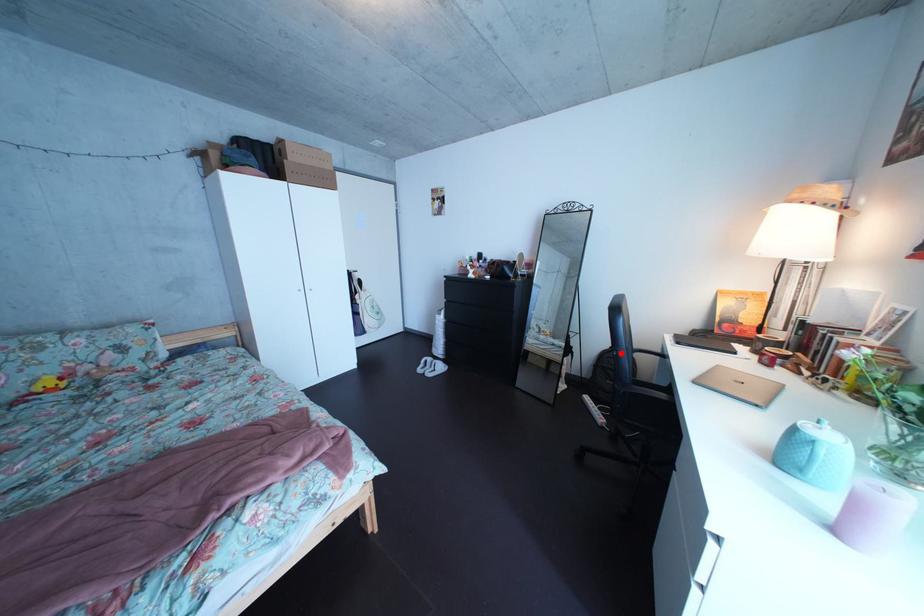
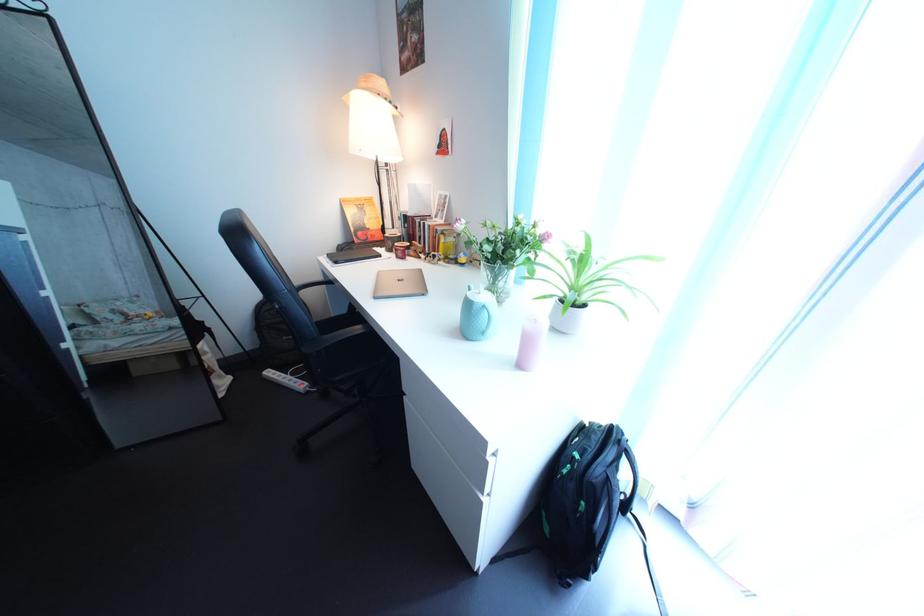
Question: I am providing you with two images of the same scene from different viewpoints. In image1, a red point is highlighted. Considering the same 3D point in image2, which of the following is correct?

Choices:
 (A) It is closer
 (B) It is farther

Answer: (A)